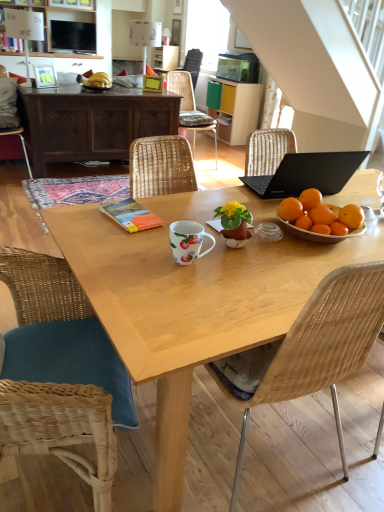
Identify the location of vacant area that is in front of orange matte book at center. This screenshot has height=512, width=384. (123, 236).